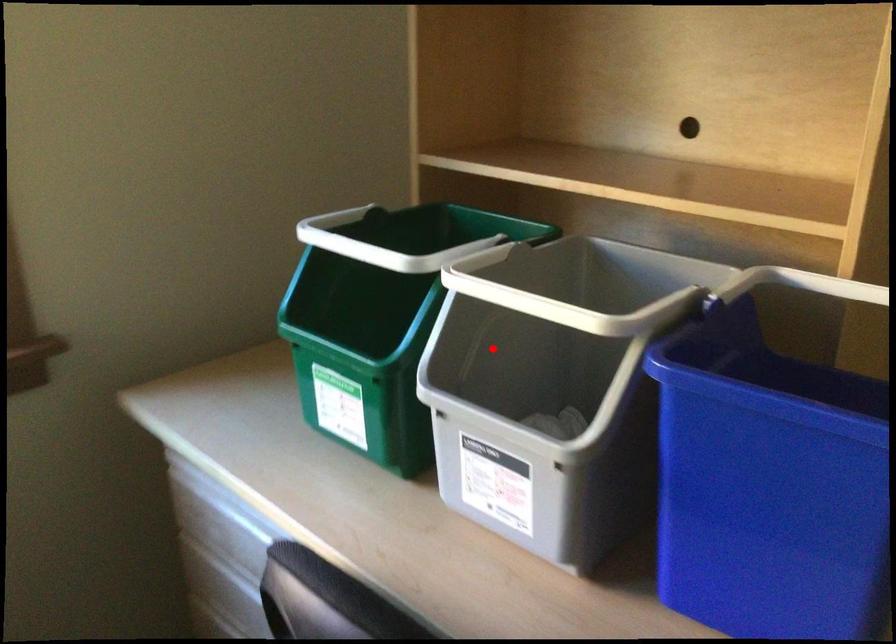
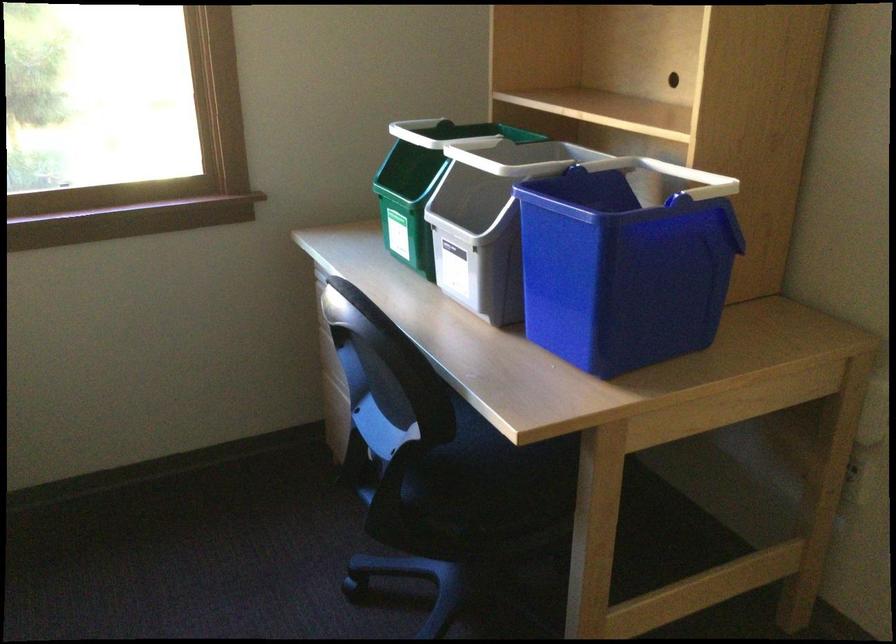
In the second image, find the point that corresponds to the highlighted location in the first image.

(479, 201)